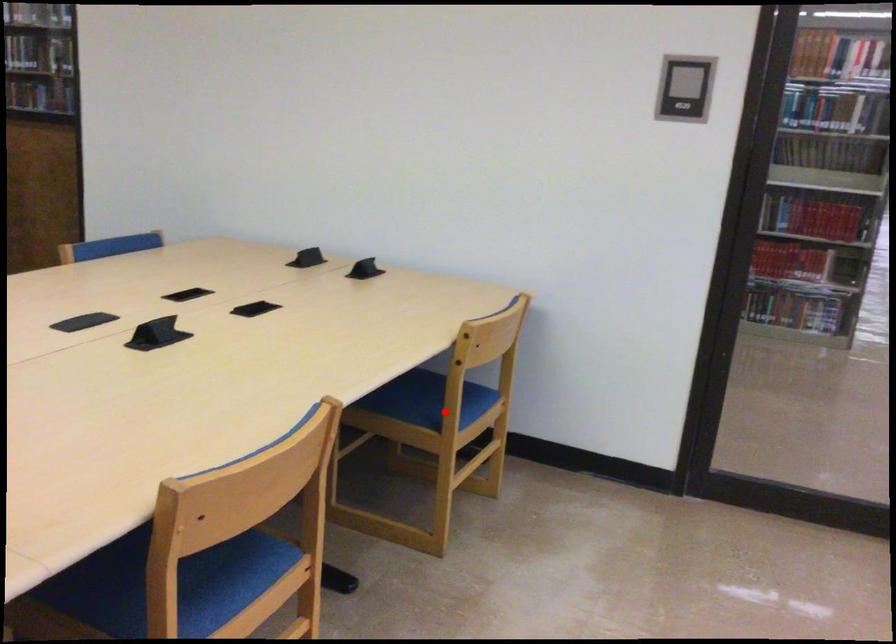
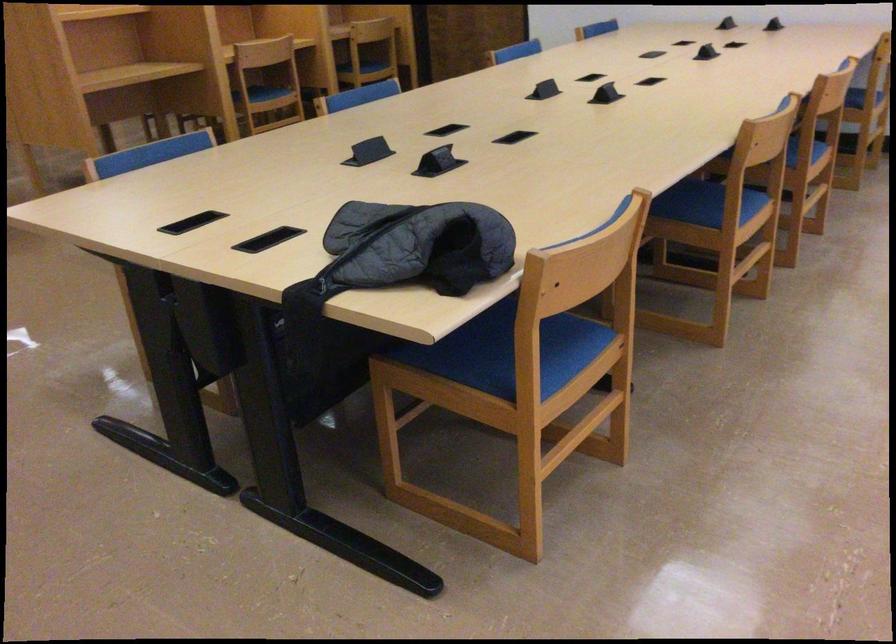
Question: I am providing you with two images of the same scene from different viewpoints. In image1, a red point is highlighted. Considering the same 3D point in image2, which of the following is correct?

Choices:
 (A) It is closer
 (B) It is farther

Answer: (B)